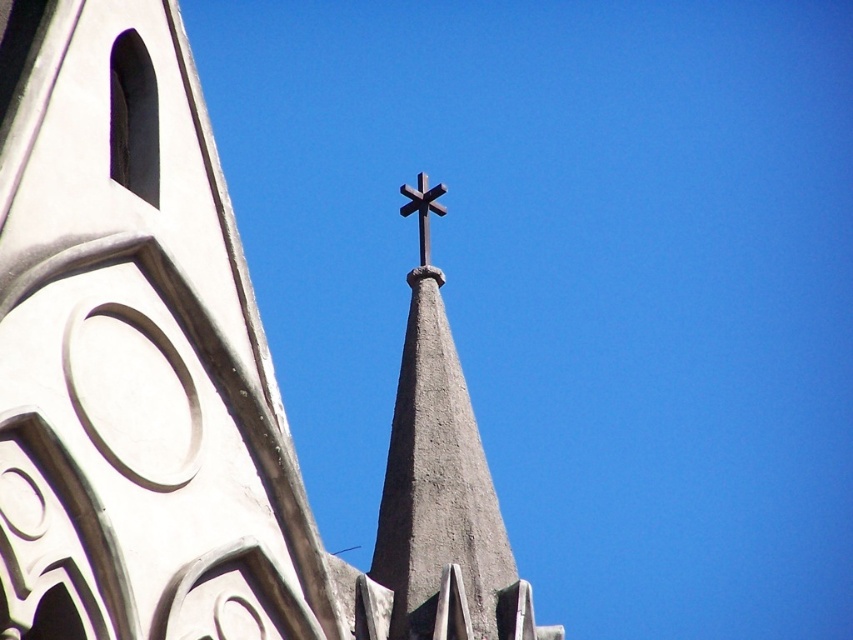
Question: Is smooth gray steeple at center below dark brown wooden cross at center?

Choices:
 (A) yes
 (B) no

Answer: (A)

Question: Which of the following is the closest to the observer?

Choices:
 (A) (111, 218)
 (B) (397, 636)
 (C) (399, 209)

Answer: (A)

Question: Can you confirm if gray stone spire at center is positioned below dark brown wooden cross at center?

Choices:
 (A) yes
 (B) no

Answer: (A)

Question: Does smooth gray steeple at center appear on the right side of dark brown wooden cross at center?

Choices:
 (A) no
 (B) yes

Answer: (A)

Question: Which object appears farthest from the camera in this image?

Choices:
 (A) smooth gray steeple at center
 (B) gray stone spire at center
 (C) dark brown wooden cross at center

Answer: (C)

Question: Estimate the real-world distances between objects in this image. Which object is farther from the dark brown wooden cross at center?

Choices:
 (A) gray stone spire at center
 (B) smooth gray steeple at center

Answer: (B)